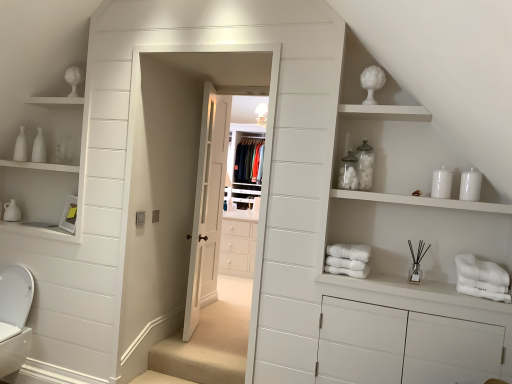
What do you see at coordinates (348, 260) in the screenshot? I see `white soft bath towel at center, which ranks as the 2th bath towel in right-to-left order` at bounding box center [348, 260].

What do you see at coordinates (207, 203) in the screenshot? The height and width of the screenshot is (384, 512). I see `white wooden door at center` at bounding box center [207, 203].

The width and height of the screenshot is (512, 384). What are the coordinates of `white matte shelves at upper center` in the screenshot? It's located at (362, 233).

Image resolution: width=512 pixels, height=384 pixels. What do you see at coordinates (14, 317) in the screenshot?
I see `white glossy toilet bowl at lower left` at bounding box center [14, 317].

In order to click on white soft bath towel at center, which ranks as the 2th bath towel in right-to-left order in this screenshot , I will do `click(348, 260)`.

Is point (23, 323) positioned in front of point (461, 262)?

No, (23, 323) is further to viewer.

From the image's perspective, which one is positioned higher, white glossy toilet bowl at lower left or white cotton bath towel at lower right, which is the 2th bath towel in left-to-right order?

white cotton bath towel at lower right, which is the 2th bath towel in left-to-right order, is shown above in the image.

Is white glossy toilet bowl at lower left positioned with its back to white cotton bath towel at lower right, the 1th bath towel positioned from the right?

No, white cotton bath towel at lower right, the 1th bath towel positioned from the right, is not at the back of white glossy toilet bowl at lower left.

Is white glossy toilet bowl at lower left thinner than white cotton bath towel at lower right, which is the 2th bath towel in left-to-right order?

Correct, the width of white glossy toilet bowl at lower left is less than that of white cotton bath towel at lower right, which is the 2th bath towel in left-to-right order.

Considering the relative positions of white wooden door at center and white matte shelves at upper center in the image provided, is white wooden door at center to the left or to the right of white matte shelves at upper center?

white wooden door at center is to the left of white matte shelves at upper center.

Find the location of a particular element. This screenshot has height=384, width=512. door on the left of white matte shelves at upper center is located at coordinates (207, 203).

Considering the points (212, 198) and (297, 353), which point is behind, point (212, 198) or point (297, 353)?

Point (212, 198)

Considering the relative sizes of white wooden door at center and white matte shelves at upper center in the image provided, is white wooden door at center taller than white matte shelves at upper center?

Yes, white wooden door at center is taller than white matte shelves at upper center.

Considering the sizes of white cotton bath towel at lower right, which is the 2th bath towel in left-to-right order, and white matte shelves at upper center in the image, is white cotton bath towel at lower right, which is the 2th bath towel in left-to-right order, bigger or smaller than white matte shelves at upper center?

white cotton bath towel at lower right, which is the 2th bath towel in left-to-right order, is smaller than white matte shelves at upper center.

Is white cotton bath towel at lower right, the 1th bath towel positioned from the right, aimed at white matte shelves at upper center?

Yes, white cotton bath towel at lower right, the 1th bath towel positioned from the right, is turned towards white matte shelves at upper center.

Is white cotton bath towel at lower right, which is the 2th bath towel in left-to-right order, taller or shorter than white matte shelves at upper center?

Clearly, white cotton bath towel at lower right, which is the 2th bath towel in left-to-right order, is shorter compared to white matte shelves at upper center.

Where is `dresser lying above the white cotton bath towel at lower right, the 1th bath towel positioned from the right (from the image's perspective)`? The image size is (512, 384). dresser lying above the white cotton bath towel at lower right, the 1th bath towel positioned from the right (from the image's perspective) is located at coordinates (362, 233).

What's the angular difference between white matte shelves at upper center and white wooden door at center's facing directions?

The angle between the facing direction of white matte shelves at upper center and the facing direction of white wooden door at center is 104 degrees.

Is white matte shelves at upper center shorter than white wooden door at center?

Yes, white matte shelves at upper center is shorter than white wooden door at center.

Find the location of `door behind the white matte shelves at upper center`. door behind the white matte shelves at upper center is located at coordinates (207, 203).

Does white matte shelves at upper center have a larger size compared to white wooden door at center?

Yes.

Is point (6, 309) closer or farther from the camera than point (359, 267)?

Point (6, 309) is farther from the camera than point (359, 267).

Is white glossy toilet bowl at lower left situated inside white soft bath towel at center, which ranks as the 2th bath towel in right-to-left order, or outside?

white glossy toilet bowl at lower left exists outside the volume of white soft bath towel at center, which ranks as the 2th bath towel in right-to-left order.

Which of these two, white glossy toilet bowl at lower left or white soft bath towel at center, which is counted as the 1th bath towel, starting from the left, is bigger?

white glossy toilet bowl at lower left.

From a real-world perspective, between white glossy toilet bowl at lower left and white soft bath towel at center, which is counted as the 1th bath towel, starting from the left, who is vertically lower?

From a 3D spatial view, white glossy toilet bowl at lower left is below.

Is white soft bath towel at center, which is counted as the 1th bath towel, starting from the left, at the left side of white matte shelves at upper center?

Yes, white soft bath towel at center, which is counted as the 1th bath towel, starting from the left, is to the left of white matte shelves at upper center.

Which of these two, white soft bath towel at center, which ranks as the 2th bath towel in right-to-left order, or white matte shelves at upper center, is bigger?

white matte shelves at upper center is bigger.

Which object is thinner, white soft bath towel at center, which is counted as the 1th bath towel, starting from the left, or white matte shelves at upper center?

white soft bath towel at center, which is counted as the 1th bath towel, starting from the left.

Is white soft bath towel at center, which ranks as the 2th bath towel in right-to-left order, touching white matte shelves at upper center?

No, white soft bath towel at center, which ranks as the 2th bath towel in right-to-left order, is not with white matte shelves at upper center.

In the image, is white glossy toilet bowl at lower left positioned in front of or behind white matte shelves at upper center?

white glossy toilet bowl at lower left is behind white matte shelves at upper center.

Can you confirm if white glossy toilet bowl at lower left is thinner than white matte shelves at upper center?

Yes.

Between white glossy toilet bowl at lower left and white matte shelves at upper center, which one has less height?

white glossy toilet bowl at lower left.

Between white glossy toilet bowl at lower left and white matte shelves at upper center, which one has larger size?

With larger size is white matte shelves at upper center.

The width and height of the screenshot is (512, 384). Identify the location of toilet bowl lying behind the white cotton bath towel at lower right, which is the 2th bath towel in left-to-right order. (14, 317).

You are a GUI agent. You are given a task and a screenshot of the screen. Output one action in this format:
    pyautogui.click(x=<x>, y=<y>)
    Task: Click on the door below the white matte shelves at upper center (from a real-world perspective)
    
    Given the screenshot: What is the action you would take?
    pyautogui.click(x=207, y=203)

Looking at the image, which one is located further to white cotton bath towel at lower right, which is the 2th bath towel in left-to-right order, white glossy toilet bowl at lower left or white matte shelves at upper center?

Based on the image, white glossy toilet bowl at lower left appears to be further to white cotton bath towel at lower right, which is the 2th bath towel in left-to-right order.

Looking at the image, which one is located closer to white soft bath towel at center, which ranks as the 2th bath towel in right-to-left order, white cotton bath towel at lower right, the 1th bath towel positioned from the right, or white glossy toilet bowl at lower left?

white cotton bath towel at lower right, the 1th bath towel positioned from the right, lies closer to white soft bath towel at center, which ranks as the 2th bath towel in right-to-left order, than the other object.

Based on the photo, estimate the real-world distances between objects in this image. Which object is closer to white glossy toilet bowl at lower left, white cotton bath towel at lower right, the 1th bath towel positioned from the right, or white matte shelves at upper center?

white matte shelves at upper center is closer to white glossy toilet bowl at lower left.

In the scene shown: Based on their spatial positions, is white matte shelves at upper center or white soft bath towel at center, which ranks as the 2th bath towel in right-to-left order, further from white cotton bath towel at lower right, the 1th bath towel positioned from the right?

The object further to white cotton bath towel at lower right, the 1th bath towel positioned from the right, is white soft bath towel at center, which ranks as the 2th bath towel in right-to-left order.

Considering their positions, is white wooden door at center positioned closer to white soft bath towel at center, which ranks as the 2th bath towel in right-to-left order, than white glossy toilet bowl at lower left?

white wooden door at center is closer to white soft bath towel at center, which ranks as the 2th bath towel in right-to-left order.

Considering their positions, is white soft bath towel at center, which ranks as the 2th bath towel in right-to-left order, positioned closer to white cotton bath towel at lower right, the 1th bath towel positioned from the right, than white glossy toilet bowl at lower left?

Based on the image, white soft bath towel at center, which ranks as the 2th bath towel in right-to-left order, appears to be nearer to white cotton bath towel at lower right, the 1th bath towel positioned from the right.

Which object lies further to the anchor point white wooden door at center, white soft bath towel at center, which is counted as the 1th bath towel, starting from the left, or white glossy toilet bowl at lower left?

white soft bath towel at center, which is counted as the 1th bath towel, starting from the left, is further to white wooden door at center.

From the image, which object appears to be nearer to white glossy toilet bowl at lower left, white cotton bath towel at lower right, the 1th bath towel positioned from the right, or white soft bath towel at center, which is counted as the 1th bath towel, starting from the left?

The object closer to white glossy toilet bowl at lower left is white soft bath towel at center, which is counted as the 1th bath towel, starting from the left.

Find the location of a particular element. This screenshot has width=512, height=384. bath towel located between white wooden door at center and white matte shelves at upper center in the left-right direction is located at coordinates (348, 260).

Find the location of `door located between white glossy toilet bowl at lower left and white matte shelves at upper center in the left-right direction`. door located between white glossy toilet bowl at lower left and white matte shelves at upper center in the left-right direction is located at coordinates (207, 203).

Find the location of `dresser situated between white glossy toilet bowl at lower left and white cotton bath towel at lower right, which is the 2th bath towel in left-to-right order, from left to right`. dresser situated between white glossy toilet bowl at lower left and white cotton bath towel at lower right, which is the 2th bath towel in left-to-right order, from left to right is located at coordinates (362, 233).

The height and width of the screenshot is (384, 512). Identify the location of bath towel situated between white glossy toilet bowl at lower left and white matte shelves at upper center from left to right. (348, 260).